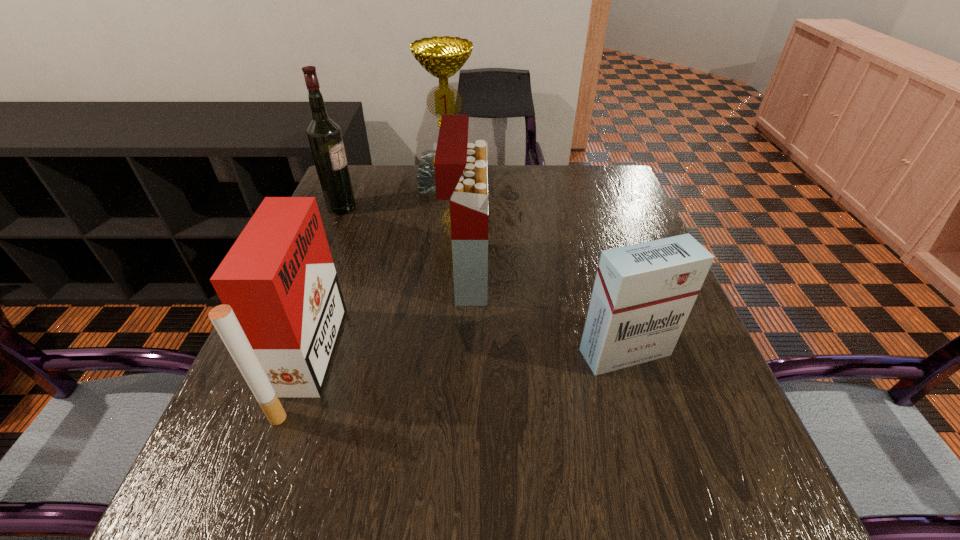
The image size is (960, 540). Find the location of `object that is the nearest to the award`. object that is the nearest to the award is located at coordinates (324, 135).

Where is `object that is the fourth closest to the rightmost object`? object that is the fourth closest to the rightmost object is located at coordinates (324, 135).

The image size is (960, 540). I want to click on cigarette case object that ranks as the second closest to the fourth nearest object, so click(282, 311).

Locate which cigarette case is the third closest to the farthest object. Please provide its 2D coordinates. Your answer should be formatted as a tuple, i.e. [(x, y)], where the tuple contains the x and y coordinates of a point satisfying the conditions above.

[(643, 293)]

Identify the location of free spot that satisfies the following two spatial constraints: 1. on the front and back of the rightmost object; 2. on the left side of the fourth nearest object. The height and width of the screenshot is (540, 960). (281, 352).

At what (x,y) coordinates should I click in order to perform the action: click on vacant area in the image that satisfies the following two spatial constraints: 1. on the front-facing side of the award; 2. on the front-facing side of the leftmost cigarette case. Please return your answer as a coordinate pair (x, y). This screenshot has width=960, height=540. Looking at the image, I should click on (429, 361).